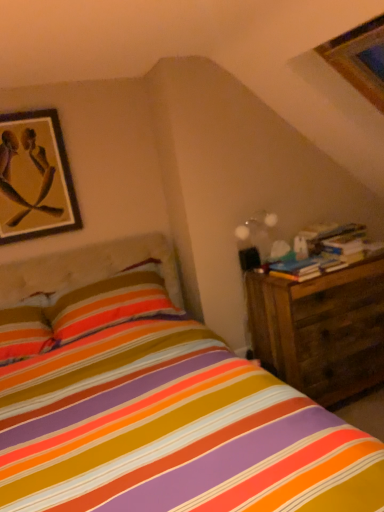
Question: Is wooden framed artwork at upper left to the right of translucent glass globe at upper right from the viewer's perspective?

Choices:
 (A) no
 (B) yes

Answer: (A)

Question: Considering the relative sizes of wooden framed artwork at upper left and translucent glass globe at upper right in the image provided, is wooden framed artwork at upper left bigger than translucent glass globe at upper right?

Choices:
 (A) yes
 (B) no

Answer: (A)

Question: From a real-world perspective, is wooden framed artwork at upper left positioned under translucent glass globe at upper right based on gravity?

Choices:
 (A) no
 (B) yes

Answer: (A)

Question: Is wooden framed artwork at upper left placed right next to translucent glass globe at upper right?

Choices:
 (A) no
 (B) yes

Answer: (A)

Question: Is wooden framed artwork at upper left to the left of translucent glass globe at upper right from the viewer's perspective?

Choices:
 (A) no
 (B) yes

Answer: (B)

Question: From a real-world perspective, is wooden framed artwork at upper left on translucent glass globe at upper right?

Choices:
 (A) yes
 (B) no

Answer: (A)

Question: Is translucent glass globe at upper right touching wooden framed artwork at upper left?

Choices:
 (A) no
 (B) yes

Answer: (A)

Question: Can you confirm if translucent glass globe at upper right is wider than wooden framed artwork at upper left?

Choices:
 (A) yes
 (B) no

Answer: (A)

Question: Is translucent glass globe at upper right located outside wooden framed artwork at upper left?

Choices:
 (A) no
 (B) yes

Answer: (B)

Question: From the image's perspective, is translucent glass globe at upper right located above wooden framed artwork at upper left?

Choices:
 (A) no
 (B) yes

Answer: (A)

Question: From the image's perspective, is translucent glass globe at upper right below wooden framed artwork at upper left?

Choices:
 (A) yes
 (B) no

Answer: (A)

Question: Does translucent glass globe at upper right have a lesser width compared to wooden framed artwork at upper left?

Choices:
 (A) yes
 (B) no

Answer: (B)

Question: Can you confirm if wooden nightstand at right is thinner than wooden framed artwork at upper left?

Choices:
 (A) no
 (B) yes

Answer: (A)